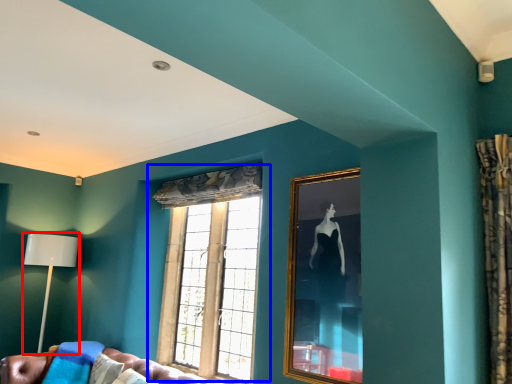
Question: Which point is further to the camera, table lamp (highlighted by a red box) or window (highlighted by a blue box)?

Choices:
 (A) table lamp
 (B) window

Answer: (A)